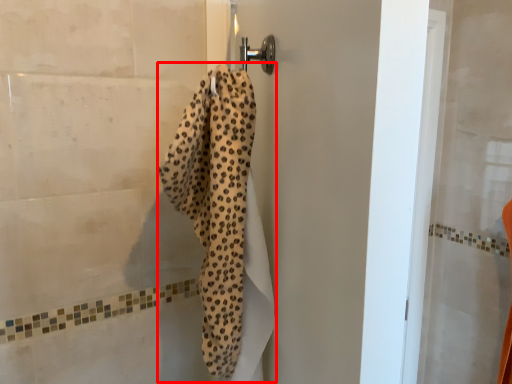
Question: Considering the relative positions of bath towel (annotated by the red box) and screen door in the image provided, where is bath towel (annotated by the red box) located with respect to the staircase?

Choices:
 (A) left
 (B) right

Answer: (A)